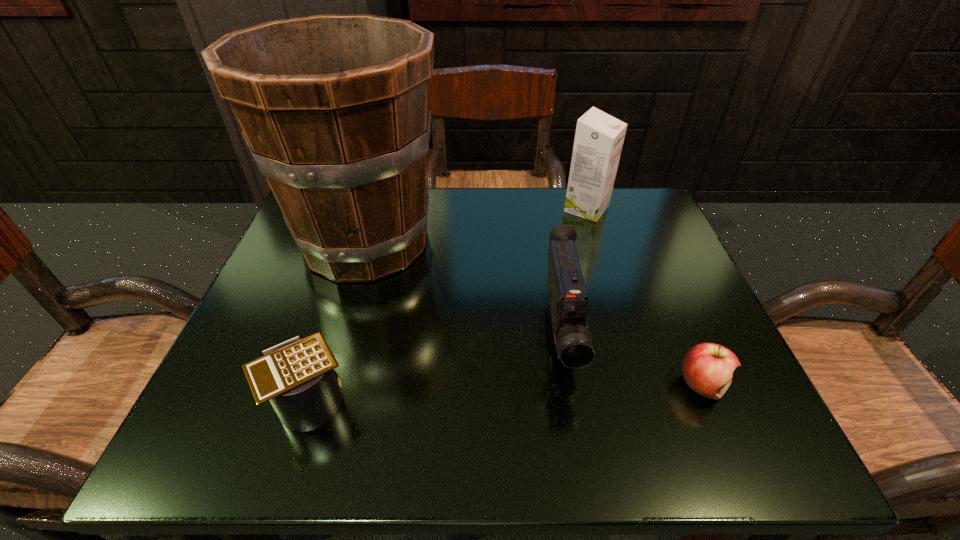
The image size is (960, 540). I want to click on free space between the third object from right to left and the shortest object, so click(x=632, y=360).

This screenshot has height=540, width=960. In order to click on vacant area that lies between the third object from left to right and the tallest object in this screenshot , I will do `click(464, 288)`.

Locate an element on the screen. vacant area that lies between the third shortest object and the tallest object is located at coordinates (464, 288).

Locate an element on the screen. The height and width of the screenshot is (540, 960). free spot between the third object from right to left and the apple is located at coordinates (632, 360).

Identify the location of unoccupied area between the apple and the camcorder. Image resolution: width=960 pixels, height=540 pixels. (632, 360).

You are a GUI agent. You are given a task and a screenshot of the screen. Output one action in this format:
    pyautogui.click(x=<x>, y=<y>)
    Task: Click on the free space between the third tallest object and the tallest object
    The image size is (960, 540).
    Given the screenshot: What is the action you would take?
    pyautogui.click(x=464, y=288)

At what (x,y) coordinates should I click in order to perform the action: click on unoccupied area between the apple and the tallest object. Please return your answer as a coordinate pair (x, y). This screenshot has height=540, width=960. Looking at the image, I should click on (534, 313).

The height and width of the screenshot is (540, 960). Identify the location of vacant area between the rightmost object and the second object from right to left. (644, 297).

Identify the location of unoccupied area between the second shortest object and the camcorder. (435, 368).

The image size is (960, 540). Find the location of `empty space between the shortest object and the second shortest object`. empty space between the shortest object and the second shortest object is located at coordinates (506, 393).